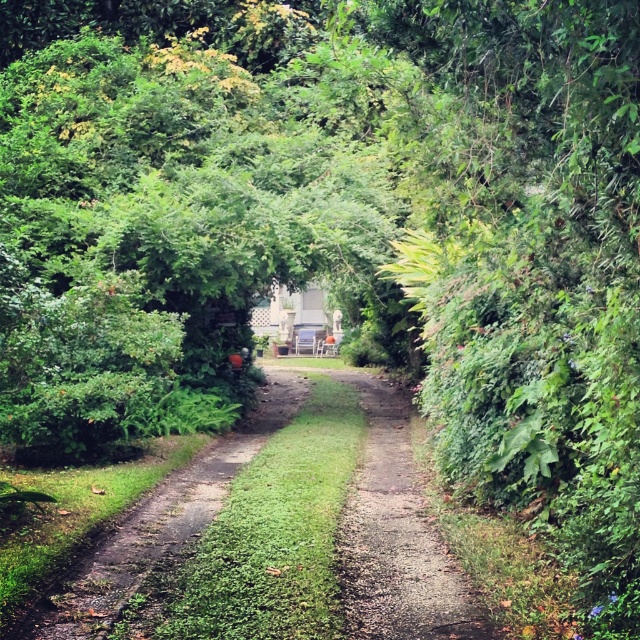
You are standing at the entrance of the garden and want to reach the white gazebo in the distance. According to the image, which direction should you walk to stay on the dirt path at center marked by point (397, 536)?

The dirt path at center marked by point (397, 536) is the correct path to follow towards the gazebo, so you should walk straight ahead along it.

In the scene shown: You are a gardener trying to mow the green grassy trail at center and the dirt path at center. Since you can only mow one at a time, which one should you mow first if you want to mow the one that is on the left side first?

The green grassy trail at center is on the left side of the dirt path at center, so you should mow the green grassy trail at center first.